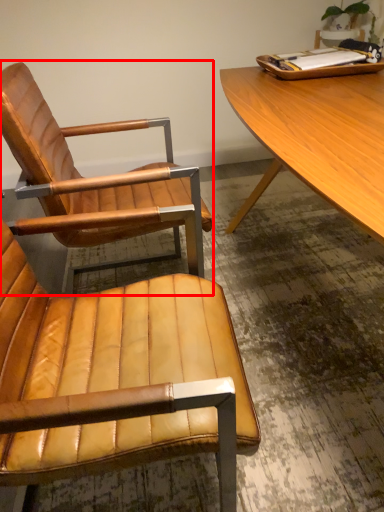
Question: From the image's perspective, where is chair (annotated by the red box) located relative to chair?

Choices:
 (A) below
 (B) above

Answer: (B)